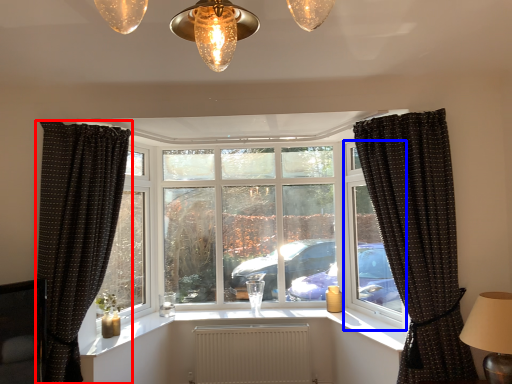
Question: Among these objects, which one is farthest to the camera, curtain (highlighted by a red box) or window frame (highlighted by a blue box)?

Choices:
 (A) curtain
 (B) window frame

Answer: (B)